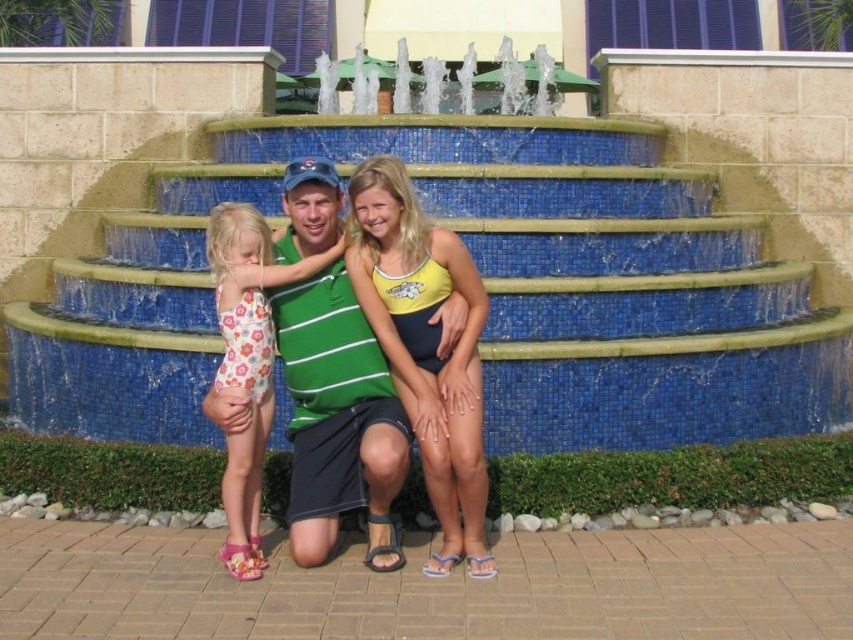
You are a photographer trying to capture a candid shot of the man in the green striped shirt at center and the girl in the floral print swimsuit at left. Since you want to ensure both subjects are in focus, you need to know their vertical positions. Which one is positioned lower in the image?

The green striped shirt at center is located below the floral print swimsuit at left, so the man in the green striped shirt at center is positioned lower in the image.

You are standing at the origin point of the image coordinate system. The man in the green striped shirt at center is at point 0.656, 0.397. If you want to move towards him, which direction should you go?

The green striped shirt at center is located at coordinates (338, 419). Since the origin is at the bottom left corner of the image, moving towards the positive x and y directions would bring you closer to the man.

You are a photographer trying to capture the entire scene of the blue mosaic stairs at center and the green striped shirt at center in one shot. Based on their sizes, which one should you focus on to ensure both are visible without cropping?

The blue mosaic stairs at center is larger in size than the green striped shirt at center, so you should focus on the blue mosaic stairs at center to ensure both are visible without cropping.